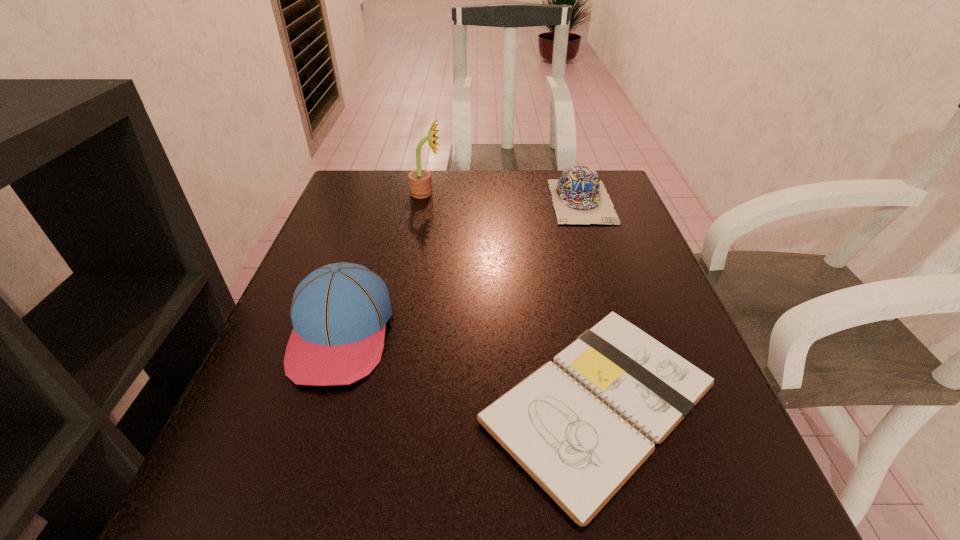
Image resolution: width=960 pixels, height=540 pixels. I want to click on blank space at the near left corner, so click(x=311, y=501).

Where is `free spot at the far right corner of the desktop`? free spot at the far right corner of the desktop is located at coordinates (614, 200).

This screenshot has width=960, height=540. Identify the location of free space at the near right corner of the desktop. coord(718,496).

You are a GUI agent. You are given a task and a screenshot of the screen. Output one action in this format:
    pyautogui.click(x=<x>, y=<y>)
    Task: Click on the free space between the cap and the notepad
    
    Given the screenshot: What is the action you would take?
    pyautogui.click(x=590, y=302)

Where is `empty space between the second shortest object and the baseball cap`? The image size is (960, 540). empty space between the second shortest object and the baseball cap is located at coordinates (462, 267).

Image resolution: width=960 pixels, height=540 pixels. In order to click on free space between the shortest object and the cap in this screenshot , I will do `click(590, 302)`.

Where is `vacant space that's between the cap and the baseball cap`? This screenshot has width=960, height=540. vacant space that's between the cap and the baseball cap is located at coordinates (462, 267).

This screenshot has height=540, width=960. I want to click on vacant space that's between the tallest object and the cap, so click(504, 197).

Where is `blank region between the notepad and the baseball cap`? The width and height of the screenshot is (960, 540). blank region between the notepad and the baseball cap is located at coordinates (470, 368).

I want to click on vacant area that lies between the shortest object and the tallest object, so click(x=513, y=298).